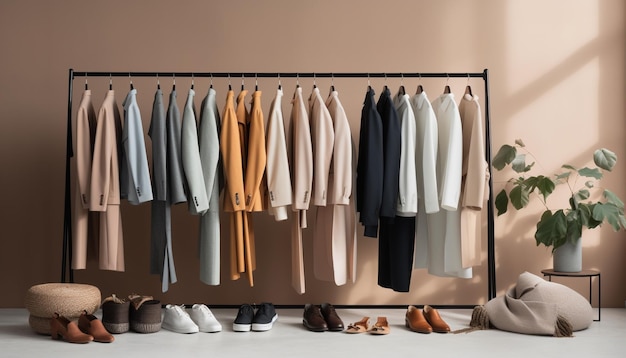
Where is `black garment rack metal`? This screenshot has height=358, width=626. black garment rack metal is located at coordinates (71, 277), (61, 273), (295, 308), (493, 279), (488, 292), (424, 75).